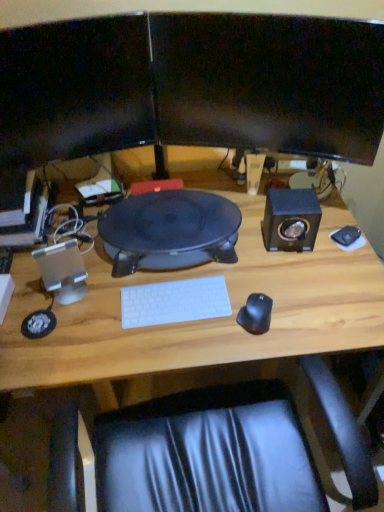
This screenshot has height=512, width=384. What are the coordinates of `vacant space in front of white plastic keyboard at center` in the screenshot? It's located at (171, 345).